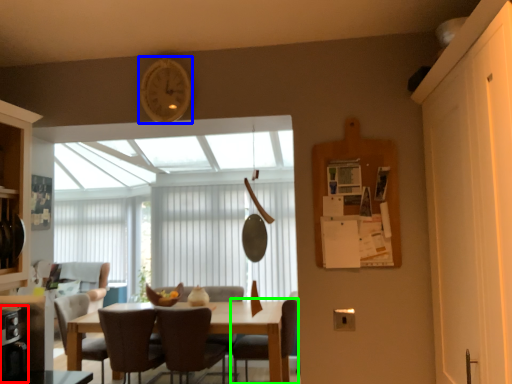
Question: Based on their relative distances, which object is nearer to appliance (highlighted by a red box)? Choose from clock (highlighted by a blue box) and chair (highlighted by a green box).

Choices:
 (A) clock
 (B) chair

Answer: (A)